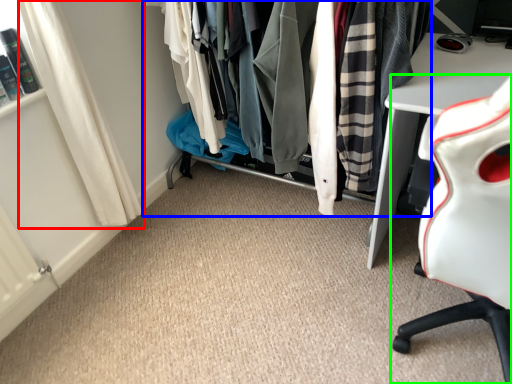
Question: Estimate the real-world distances between objects in this image. Which object is farther from curtain (highlighted by a red box), closet (highlighted by a blue box) or chair (highlighted by a green box)?

Choices:
 (A) closet
 (B) chair

Answer: (B)